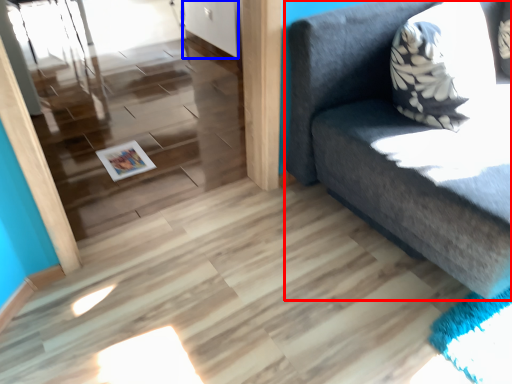
Question: Which object appears closest to the camera in this image, studio couch (highlighted by a red box) or door (highlighted by a blue box)?

Choices:
 (A) studio couch
 (B) door

Answer: (A)